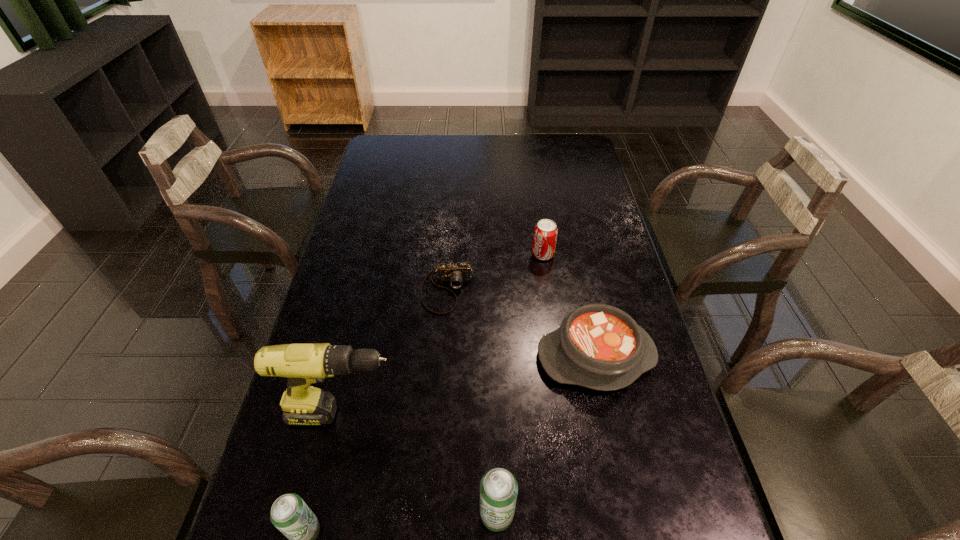
Image resolution: width=960 pixels, height=540 pixels. I want to click on the third object from right to left, so click(x=498, y=488).

Identify the location of the taller beer can. The width and height of the screenshot is (960, 540). (498, 488).

You are a GUI agent. You are given a task and a screenshot of the screen. Output one action in this format:
    pyautogui.click(x=<x>, y=<y>)
    Task: Click on the soda
    The height and width of the screenshot is (540, 960).
    Given the screenshot: What is the action you would take?
    pyautogui.click(x=545, y=234)

Find the location of a particular element. camera is located at coordinates (456, 273).

Where is `the second farthest object`? Image resolution: width=960 pixels, height=540 pixels. the second farthest object is located at coordinates (456, 273).

Locate an element on the screen. Image resolution: width=960 pixels, height=540 pixels. casserole is located at coordinates (598, 346).

Image resolution: width=960 pixels, height=540 pixels. What are the coordinates of `the fifth tallest object` in the screenshot? It's located at (598, 346).

Image resolution: width=960 pixels, height=540 pixels. I want to click on drill, so click(303, 364).

I want to click on the fourth farthest object, so click(303, 364).

The image size is (960, 540). Identify the location of vacant position located on the left of the third object from right to left. click(329, 515).